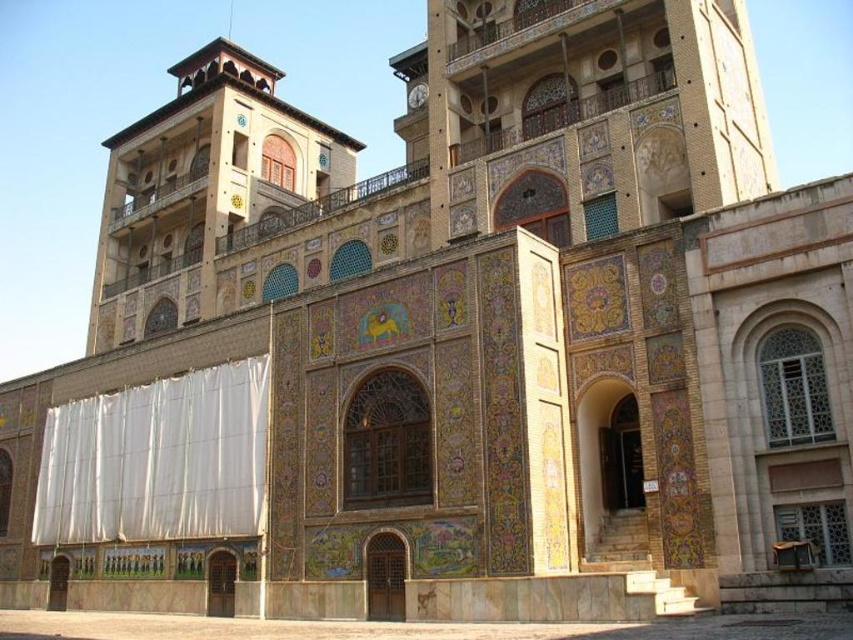
Question: Does white fabric curtain at lower left appear on the right side of metallic clock at upper center?

Choices:
 (A) no
 (B) yes

Answer: (A)

Question: Does yellowish stone tower at upper left appear on the left side of white fabric curtain at lower left?

Choices:
 (A) yes
 (B) no

Answer: (A)

Question: Among these points, which one is nearest to the camera?

Choices:
 (A) (415, 92)
 (B) (189, 113)

Answer: (A)

Question: Does white fabric curtain at lower left have a smaller size compared to metallic clock at upper center?

Choices:
 (A) yes
 (B) no

Answer: (B)

Question: Which object appears closest to the camera in this image?

Choices:
 (A) metallic clock at upper center
 (B) yellowish stone tower at upper left

Answer: (B)

Question: Among these objects, which one is nearest to the camera?

Choices:
 (A) white fabric curtain at lower left
 (B) yellowish stone tower at upper left
 (C) metallic clock at upper center

Answer: (A)